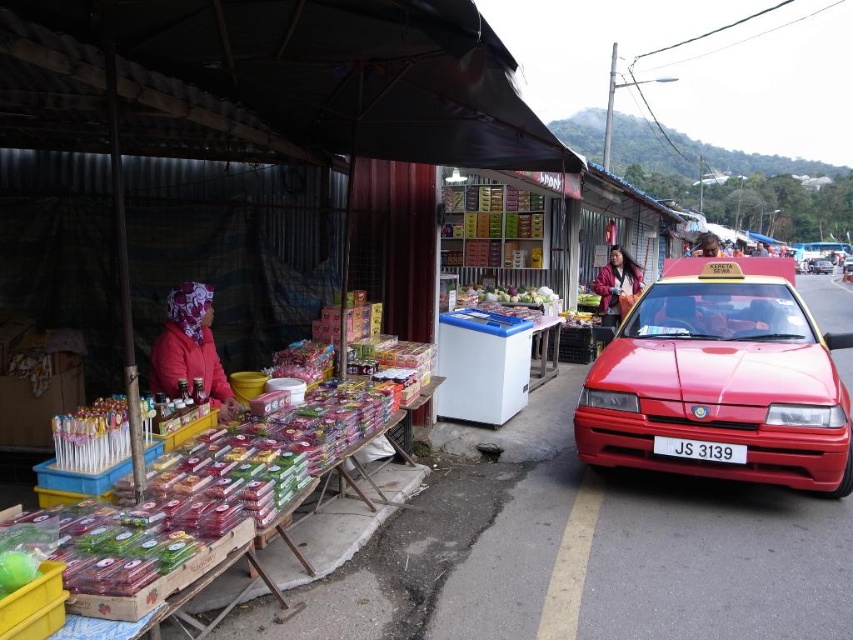
Where is `red glossy taxi at right`? This screenshot has width=853, height=640. red glossy taxi at right is located at coordinates (721, 380).

Between red glossy taxi at right and red matte taxi at right, which one has less height?

Standing shorter between the two is red matte taxi at right.

Is point (701, 422) closer to viewer compared to point (816, 259)?

Yes, point (701, 422) is closer to viewer.

Locate an element on the screen. red glossy taxi at right is located at coordinates (721, 380).

Which is more to the right, white plastic license plate at center or red matte taxi at right?

Positioned to the right is red matte taxi at right.

Does white plastic license plate at center have a greater width compared to red matte taxi at right?

In fact, white plastic license plate at center might be narrower than red matte taxi at right.

The width and height of the screenshot is (853, 640). I want to click on white plastic license plate at center, so click(699, 449).

Where is `white plastic license plate at center`? The height and width of the screenshot is (640, 853). white plastic license plate at center is located at coordinates (699, 449).

Does leather jacket at upper right appear on the left side of white plastic license plate at center?

In fact, leather jacket at upper right is to the right of white plastic license plate at center.

This screenshot has width=853, height=640. What do you see at coordinates (618, 284) in the screenshot? I see `leather jacket at upper right` at bounding box center [618, 284].

Does point (611, 312) come behind point (680, 448)?

Yes, it is behind point (680, 448).

Find the location of a particular element. The image size is (853, 640). leather jacket at upper right is located at coordinates (618, 284).